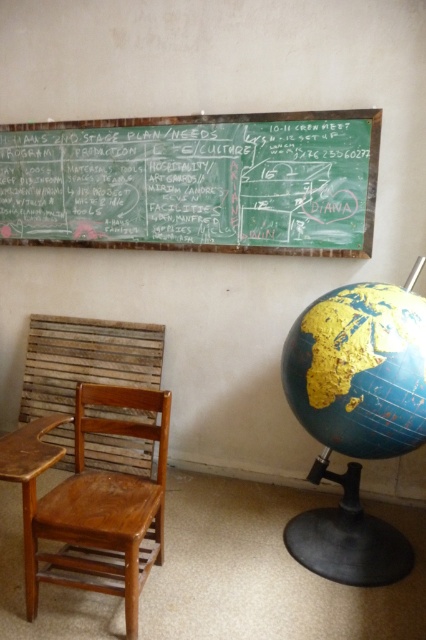
Question: In this image, where is wooden chair at left located relative to brown wood table at left?

Choices:
 (A) left
 (B) right

Answer: (B)

Question: Where is green chalkboard at upper center located in relation to wooden chair at left in the image?

Choices:
 (A) left
 (B) right

Answer: (B)

Question: Estimate the real-world distances between objects in this image. Which object is closer to the brown wood table at left?

Choices:
 (A) blue matte globe at lower right
 (B) wooden chair at left
 (C) green chalkboard at upper center

Answer: (B)

Question: Estimate the real-world distances between objects in this image. Which object is closer to the green chalkboard at upper center?

Choices:
 (A) blue matte globe at lower right
 (B) wooden chair at left
 (C) brown wood table at left

Answer: (A)

Question: Considering the relative positions of blue matte globe at lower right and brown wood table at left in the image provided, where is blue matte globe at lower right located with respect to brown wood table at left?

Choices:
 (A) left
 (B) right

Answer: (B)

Question: Which point is closer to the camera?

Choices:
 (A) blue matte globe at lower right
 (B) green chalkboard at upper center
 (C) wooden chair at left

Answer: (C)